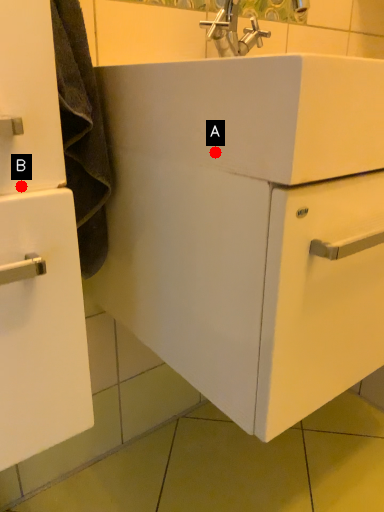
Question: Two points are circled on the image, labeled by A and B beside each circle. Which point is closer to the camera?

Choices:
 (A) A is closer
 (B) B is closer

Answer: (B)